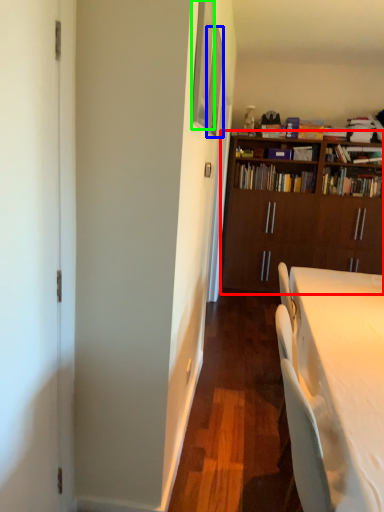
Question: Estimate the real-world distances between objects in this image. Which object is farther from bookcase (highlighted by a red box), picture frame (highlighted by a blue box) or picture frame (highlighted by a green box)?

Choices:
 (A) picture frame
 (B) picture frame

Answer: (B)